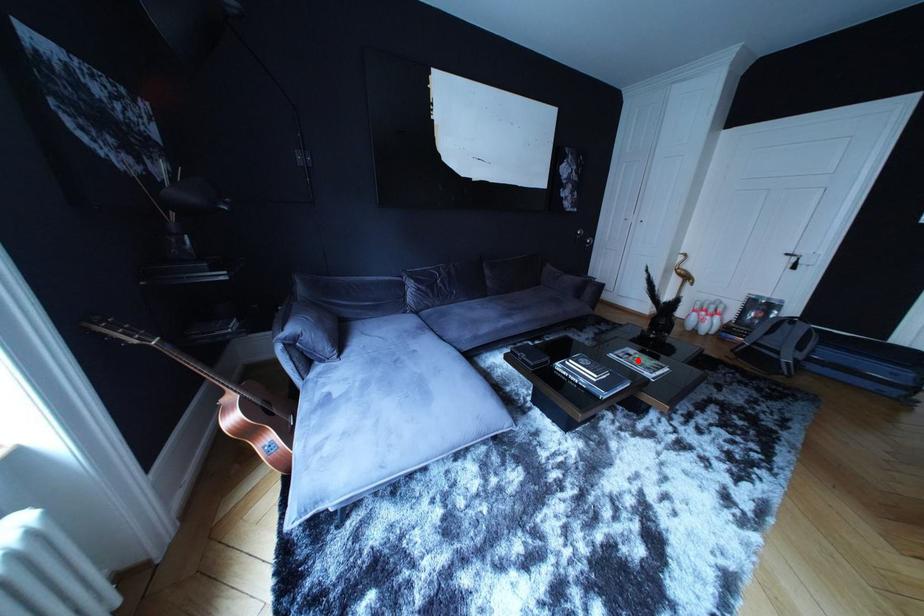
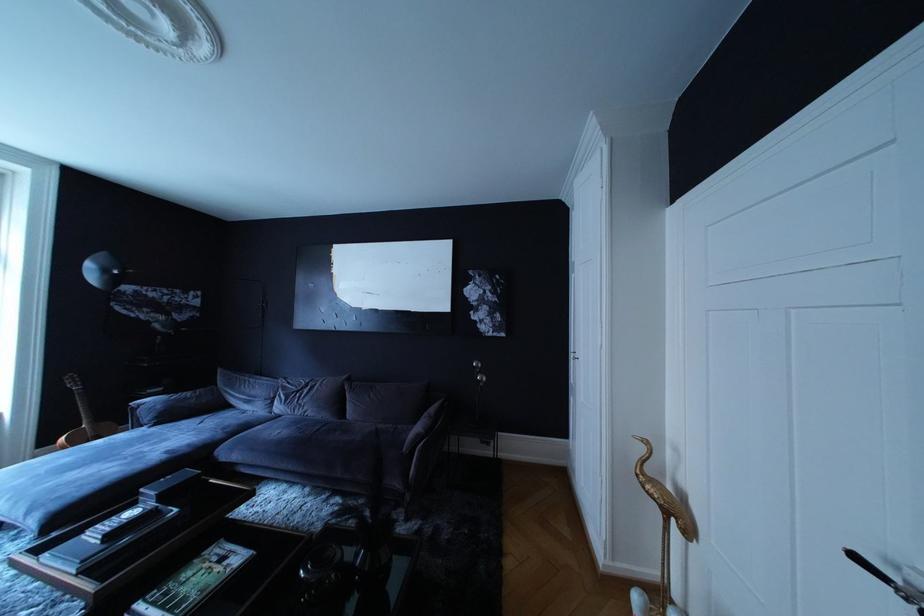
In the second image, find the point that corresponds to the highlighted location in the first image.

(232, 565)